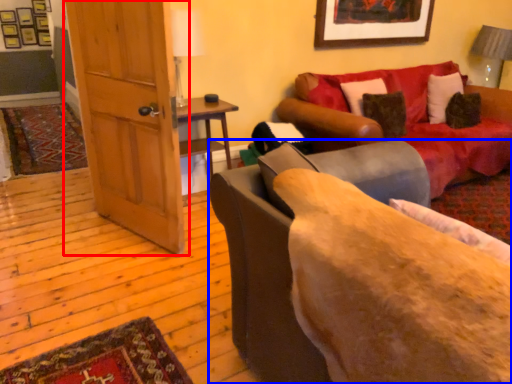
Question: Which object appears farthest to the camera in this image, door (highlighted by a red box) or studio couch (highlighted by a blue box)?

Choices:
 (A) door
 (B) studio couch

Answer: (A)